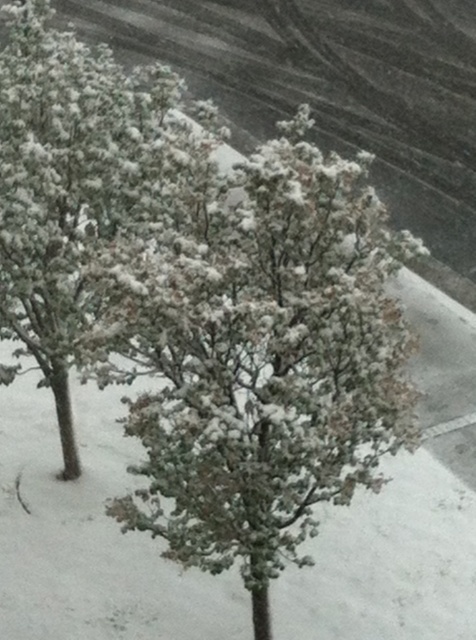
Question: Which point is farther from the camera taking this photo?

Choices:
 (A) click(366, 164)
 (B) click(22, 42)

Answer: (B)

Question: Does snow-covered tree at center have a lesser width compared to white fluffy tree at center?

Choices:
 (A) yes
 (B) no

Answer: (B)

Question: Is snow-covered tree at center wider than white fluffy tree at center?

Choices:
 (A) no
 (B) yes

Answer: (B)

Question: Among these points, which one is farthest from the camera?

Choices:
 (A) (62, 221)
 (B) (297, 369)

Answer: (A)

Question: Is snow-covered tree at center in front of white fluffy tree at center?

Choices:
 (A) no
 (B) yes

Answer: (B)